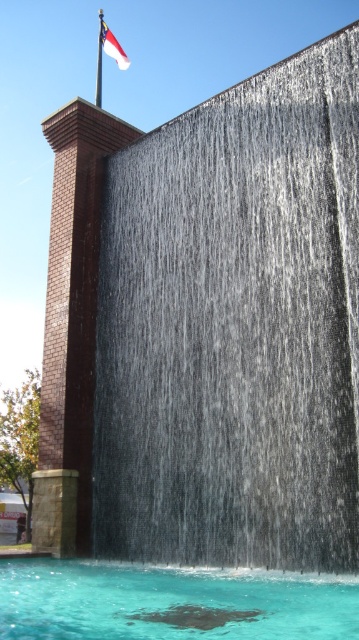
Question: Is silver metallic waterfall at upper center positioned before clear water at center?

Choices:
 (A) yes
 (B) no

Answer: (B)

Question: Which point appears farthest from the camera in this image?

Choices:
 (A) (24, 586)
 (B) (100, 80)
 (C) (355, 198)
 (D) (128, 58)

Answer: (B)

Question: Observing the image, what is the correct spatial positioning of clear water at center in reference to metallic flag pole at upper left?

Choices:
 (A) left
 (B) right

Answer: (B)

Question: Is silver metallic waterfall at upper center below metallic flag pole at upper left?

Choices:
 (A) yes
 (B) no

Answer: (A)

Question: Which object appears farthest from the camera in this image?

Choices:
 (A) white fabric flag at upper left
 (B) clear water at center

Answer: (A)

Question: Based on their relative distances, which object is nearer to the white fabric flag at upper left?

Choices:
 (A) metallic flag pole at upper left
 (B) silver metallic waterfall at upper center
 (C) clear water at center

Answer: (A)